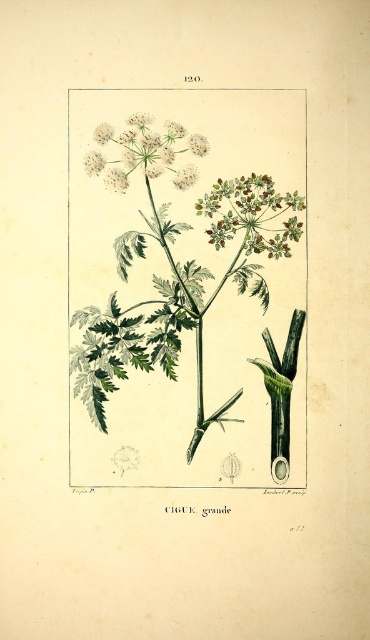
Based on the photo, you are a botanist examining the botanical illustration of CIGUE grande. You notice two points labeled as point (222, 310) and point (207, 216). Based on their positions, which point is closer to the viewer?

Point (222, 310) is further to the camera than point (207, 216), so point (207, 216) is closer to the viewer.

Based on the botanical illustration of the CIGUE grande plant, which flower is wider between the green textured flower at upper center and the white fluffy flower at upper center?

The white fluffy flower at upper center is wider than the green textured flower at upper center.